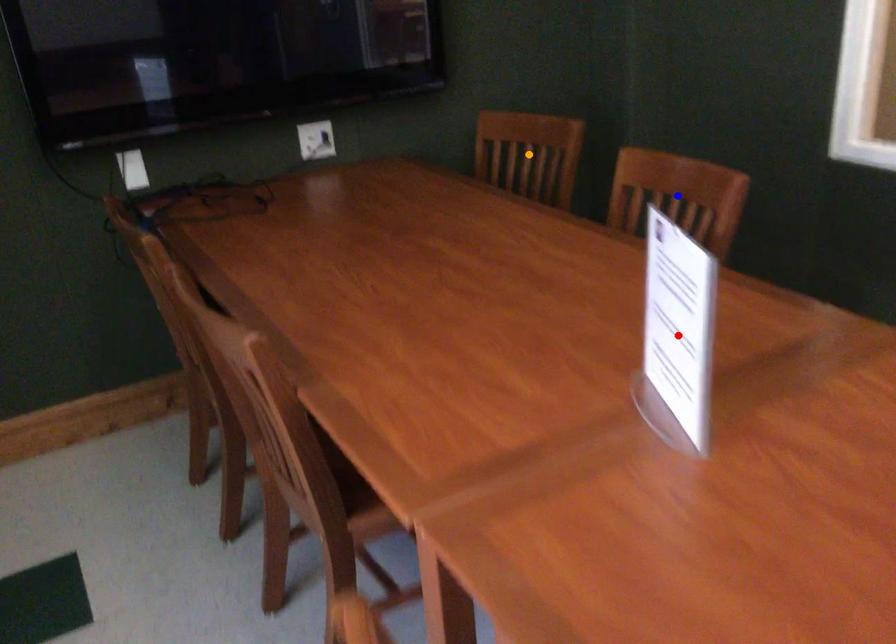
Consider the image. Order these from nearest to farthest:
A) orange point
B) blue point
C) red point

red point, blue point, orange point